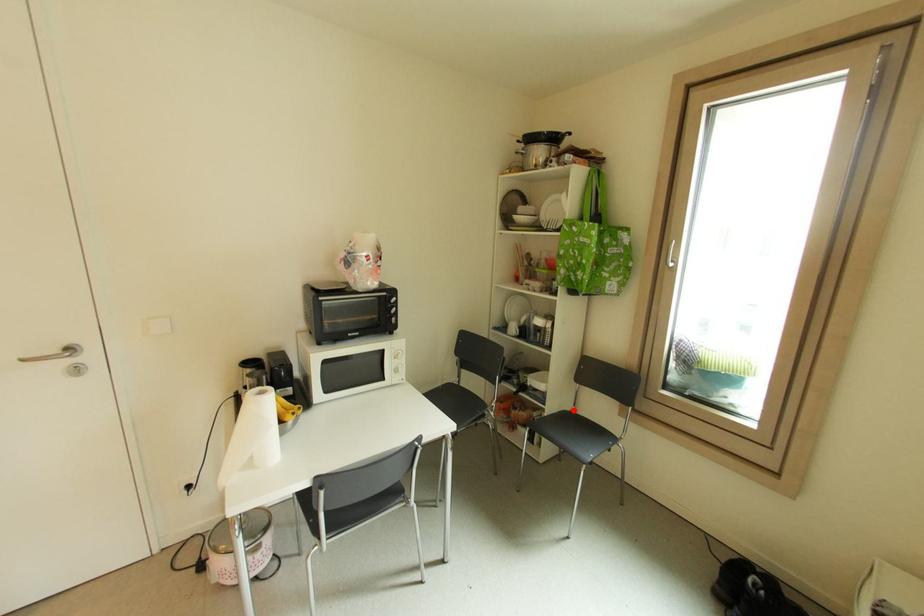
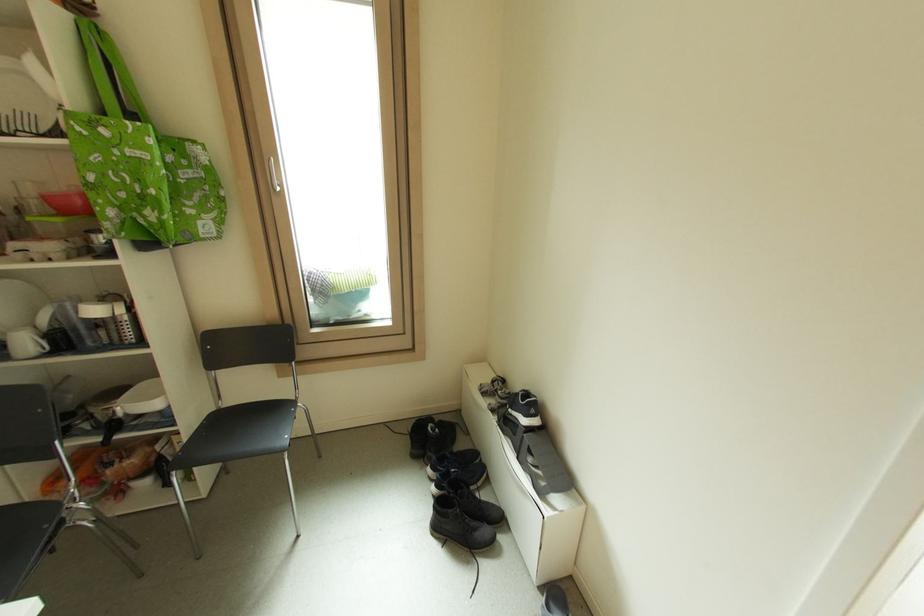
The point at the highlighted location is marked in the first image. Where is the corresponding point in the second image?

(220, 408)